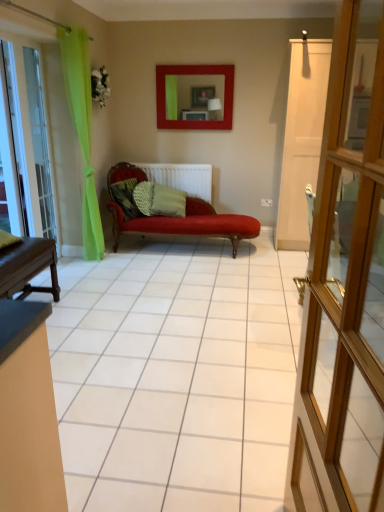
The image size is (384, 512). I want to click on transparent glass door at left, so click(x=40, y=142).

Describe the element at coordinates (168, 201) in the screenshot. The height and width of the screenshot is (512, 384). I see `green textured pillow at center, which is counted as the 1th pillow, starting from the right` at that location.

The image size is (384, 512). Identify the location of clear glass door at left. (19, 138).

What's the angular difference between white matte radiator at center and clear glass door at left's facing directions?

The facing directions of white matte radiator at center and clear glass door at left are 0.683 degrees apart.

Is white matte radiator at center looking in the opposite direction of clear glass door at left?

white matte radiator at center does not have its back to clear glass door at left.

Can you confirm if white matte radiator at center is smaller than clear glass door at left?

No.

Locate an element on the screen. The height and width of the screenshot is (512, 384). window above the white matte radiator at center (from the image's perspective) is located at coordinates (19, 138).

Is point (131, 208) less distant than point (29, 126)?

No, it is behind (29, 126).

Considering the positions of objects camouflage fabric pillow at center, the 2th pillow positioned from the right, and clear glass door at left in the image provided, who is behind, camouflage fabric pillow at center, the 2th pillow positioned from the right, or clear glass door at left?

camouflage fabric pillow at center, the 2th pillow positioned from the right.

Between camouflage fabric pillow at center, the 2th pillow positioned from the right, and clear glass door at left, which one has larger width?

camouflage fabric pillow at center, the 2th pillow positioned from the right.

How far apart are white wooden door at center and transparent glass door at left?

white wooden door at center is 3.37 meters away from transparent glass door at left.

From a real-world perspective, who is located lower, white wooden door at center or transparent glass door at left?

white wooden door at center.

From the image's perspective, which one is positioned higher, white wooden door at center or transparent glass door at left?

transparent glass door at left is shown above in the image.

This screenshot has width=384, height=512. What are the coordinates of `glass door above the white wooden door at center (from the image's perspective)` in the screenshot? It's located at (40, 142).

From the picture: Would you consider transparent glass door at left to be distant from matte red picture frame at upper center?

Indeed, transparent glass door at left is not near matte red picture frame at upper center.

I want to click on glass door located on the left of matte red picture frame at upper center, so click(40, 142).

How different are the orientations of transparent glass door at left and matte red picture frame at upper center in degrees?

The facing directions of transparent glass door at left and matte red picture frame at upper center are 87.1 degrees apart.

Between transparent glass door at left and matte red picture frame at upper center, which one has larger width?

Wider between the two is matte red picture frame at upper center.

Based on the photo, from the image's perspective, does matte red picture frame at upper center appear higher than clear glass door at left?

Yes.

From a real-world perspective, between matte red picture frame at upper center and clear glass door at left, who is vertically lower?

clear glass door at left.

Is matte red picture frame at upper center at the right side of clear glass door at left?

Correct, you'll find matte red picture frame at upper center to the right of clear glass door at left.

Does white matte radiator at center have a greater height compared to camouflage fabric pillow at center, which is the first pillow in left-to-right order?

Indeed, white matte radiator at center has a greater height compared to camouflage fabric pillow at center, which is the first pillow in left-to-right order.

Considering their positions, is white matte radiator at center located in front of or behind camouflage fabric pillow at center, which is the first pillow in left-to-right order?

In the image, white matte radiator at center appears behind camouflage fabric pillow at center, which is the first pillow in left-to-right order.

The height and width of the screenshot is (512, 384). In order to click on pillow that is on the left side of white matte radiator at center in this screenshot , I will do `click(125, 197)`.

Is point (209, 198) positioned before point (132, 180)?

No, (209, 198) is behind (132, 180).

Is green textured pillow at center, which is counted as the 1th pillow, starting from the right, to the left or to the right of white wooden door at center in the image?

Clearly, green textured pillow at center, which is counted as the 1th pillow, starting from the right, is on the left of white wooden door at center in the image.

Does green textured pillow at center, the 2th pillow viewed from the left, have a greater width compared to white wooden door at center?

Yes, green textured pillow at center, the 2th pillow viewed from the left, is wider than white wooden door at center.

Is green textured pillow at center, which is counted as the 1th pillow, starting from the right, taller than white wooden door at center?

No, green textured pillow at center, which is counted as the 1th pillow, starting from the right, is not taller than white wooden door at center.

From the image's perspective, is green textured pillow at center, which is counted as the 1th pillow, starting from the right, positioned above or below white wooden door at center?

green textured pillow at center, which is counted as the 1th pillow, starting from the right, is above white wooden door at center.

Identify the location of window in front of the white matte radiator at center. (x=19, y=138).

Identify the location of window located above the camouflage fabric pillow at center, which is the first pillow in left-to-right order (from the image's perspective). Image resolution: width=384 pixels, height=512 pixels. (19, 138).

Consider the image. From the image, which object appears to be nearer to transparent glass door at left, green textured pillow at center, the 2th pillow viewed from the left, or matte red picture frame at upper center?

The object closer to transparent glass door at left is green textured pillow at center, the 2th pillow viewed from the left.

From the image, which object appears to be farther from white matte radiator at center, green textured pillow at center, the 2th pillow viewed from the left, or transparent glass door at left?

The object further to white matte radiator at center is transparent glass door at left.

Based on their spatial positions, is white matte radiator at center or camouflage fabric pillow at center, the 2th pillow positioned from the right, closer to clear glass door at left?

Among the two, camouflage fabric pillow at center, the 2th pillow positioned from the right, is located nearer to clear glass door at left.

In the scene shown: From the image, which object appears to be nearer to white wooden door at center, clear glass door at left or matte red picture frame at upper center?

clear glass door at left is closer to white wooden door at center.

When comparing their distances from camouflage fabric pillow at center, the 2th pillow positioned from the right, does white matte radiator at center or green textured pillow at center, the 2th pillow viewed from the left, seem further?

white matte radiator at center is further to camouflage fabric pillow at center, the 2th pillow positioned from the right.

From the image, which object appears to be nearer to clear glass door at left, white matte radiator at center or matte red picture frame at upper center?

white matte radiator at center lies closer to clear glass door at left than the other object.

Looking at the image, which one is located further to white matte radiator at center, matte red picture frame at upper center or transparent glass door at left?

transparent glass door at left is further to white matte radiator at center.

Looking at the image, which one is located closer to matte red picture frame at upper center, white wooden door at center or white matte radiator at center?

The object closer to matte red picture frame at upper center is white matte radiator at center.

Where is `glass door located between white wooden door at center and green textured pillow at center, which is counted as the 1th pillow, starting from the right, in the depth direction`? The height and width of the screenshot is (512, 384). glass door located between white wooden door at center and green textured pillow at center, which is counted as the 1th pillow, starting from the right, in the depth direction is located at coordinates (40, 142).

Where is `pillow located between white wooden door at center and green textured pillow at center, the 2th pillow viewed from the left, in the depth direction`? Image resolution: width=384 pixels, height=512 pixels. pillow located between white wooden door at center and green textured pillow at center, the 2th pillow viewed from the left, in the depth direction is located at coordinates (125, 197).

You are a GUI agent. You are given a task and a screenshot of the screen. Output one action in this format:
    pyautogui.click(x=<x>, y=<y>)
    Task: Click on the glass door between white wooden door at center and matte red picture frame at upper center along the z-axis
    This screenshot has width=384, height=512.
    Given the screenshot: What is the action you would take?
    pyautogui.click(x=40, y=142)

Where is `radiator located between clear glass door at left and matte red picture frame at upper center in the left-right direction`? This screenshot has width=384, height=512. radiator located between clear glass door at left and matte red picture frame at upper center in the left-right direction is located at coordinates (182, 177).